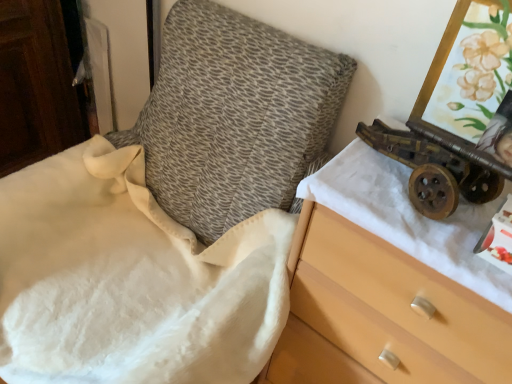
Question: Is wooden drawer at right not close to wooden chest of drawers at right?

Choices:
 (A) no
 (B) yes

Answer: (A)

Question: Considering the relative sizes of wooden drawer at right and wooden chest of drawers at right in the image provided, is wooden drawer at right taller than wooden chest of drawers at right?

Choices:
 (A) yes
 (B) no

Answer: (A)

Question: From a real-world perspective, is wooden drawer at right over wooden chest of drawers at right?

Choices:
 (A) no
 (B) yes

Answer: (B)

Question: Does wooden drawer at right appear on the left side of wooden chest of drawers at right?

Choices:
 (A) no
 (B) yes

Answer: (B)

Question: From the image's perspective, is wooden drawer at right located beneath wooden chest of drawers at right?

Choices:
 (A) no
 (B) yes

Answer: (A)

Question: Does wooden drawer at right have a greater width compared to wooden chest of drawers at right?

Choices:
 (A) no
 (B) yes

Answer: (B)

Question: Can you confirm if wooden chest of drawers at right is shorter than rusty metal cannon at right?

Choices:
 (A) yes
 (B) no

Answer: (B)

Question: Is wooden chest of drawers at right outside rusty metal cannon at right?

Choices:
 (A) no
 (B) yes

Answer: (B)

Question: Is wooden chest of drawers at right placed right next to rusty metal cannon at right?

Choices:
 (A) no
 (B) yes

Answer: (A)

Question: Is wooden chest of drawers at right positioned before rusty metal cannon at right?

Choices:
 (A) yes
 (B) no

Answer: (A)

Question: Does wooden chest of drawers at right have a greater height compared to rusty metal cannon at right?

Choices:
 (A) no
 (B) yes

Answer: (B)

Question: Is wooden chest of drawers at right not near rusty metal cannon at right?

Choices:
 (A) no
 (B) yes

Answer: (A)

Question: Can you see rusty metal cannon at right touching wooden chest of drawers at right?

Choices:
 (A) no
 (B) yes

Answer: (A)